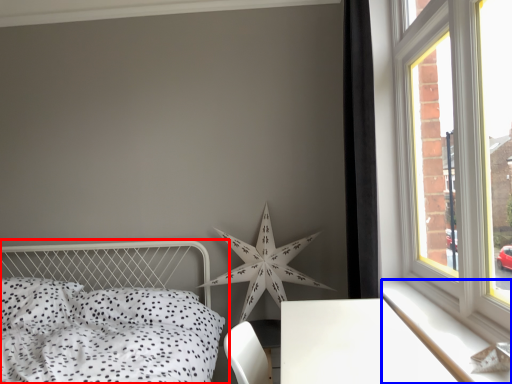
Question: Which of the following is the closest to the observer, bed (highlighted by a red box) or window sill (highlighted by a blue box)?

Choices:
 (A) bed
 (B) window sill

Answer: (A)